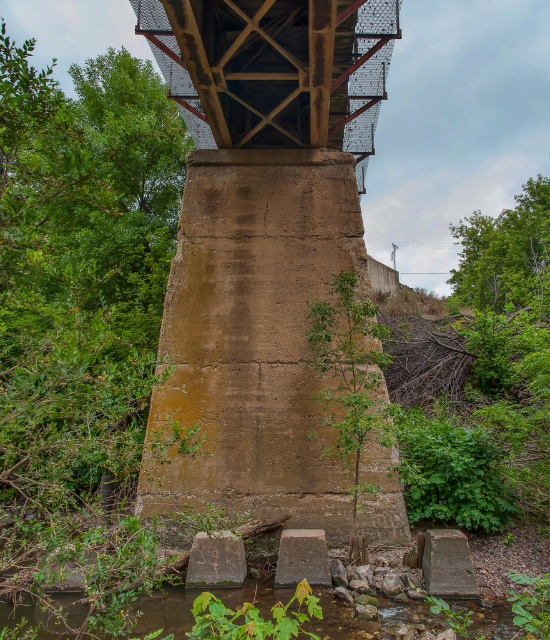
Is point (177, 28) closer to camera compared to point (393, 616)?

No, it is not.

In the scene shown: Can you confirm if rusty metal bridge at upper center is bigger than brown rocky river at lower center?

Yes.

Is point (299, 116) positioned before point (209, 593)?

No, it is not.

In order to click on rusty metal bridge at upper center in this screenshot , I will do `click(275, 68)`.